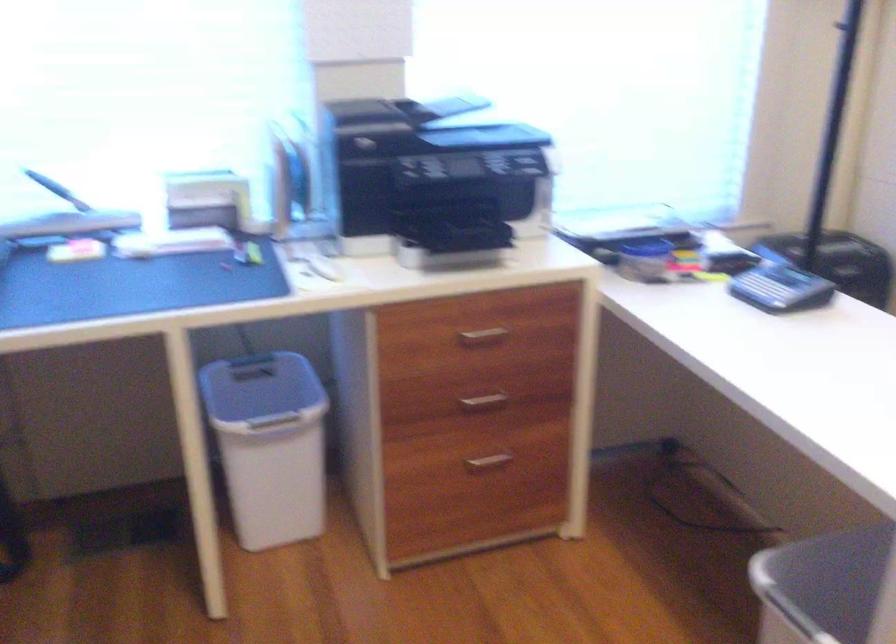
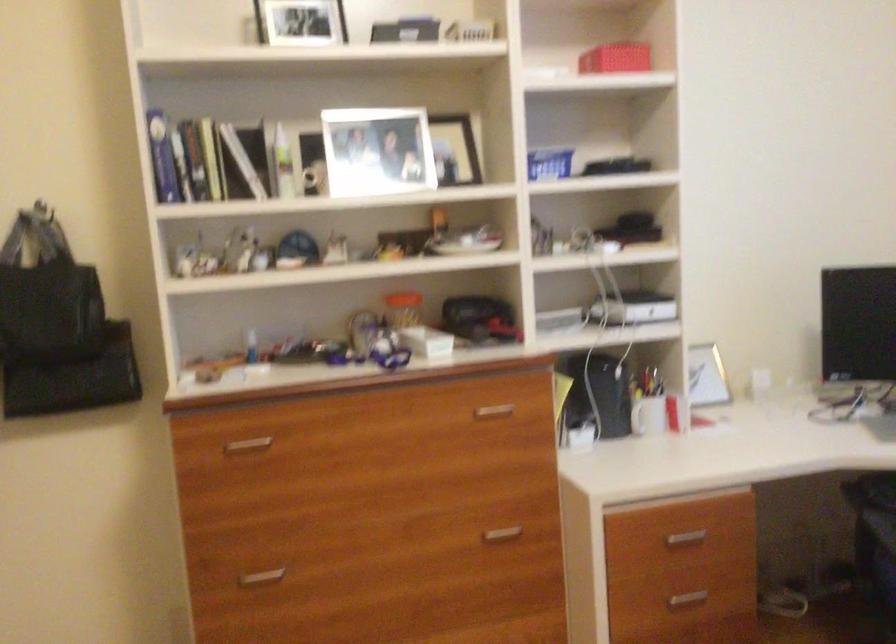
Question: The camera is either moving clockwise (left) or counter-clockwise (right) around the object. The first image is from the beginning of the video and the second image is from the end. Is the camera moving left or right when shooting the video?

Choices:
 (A) Left
 (B) Right

Answer: (B)